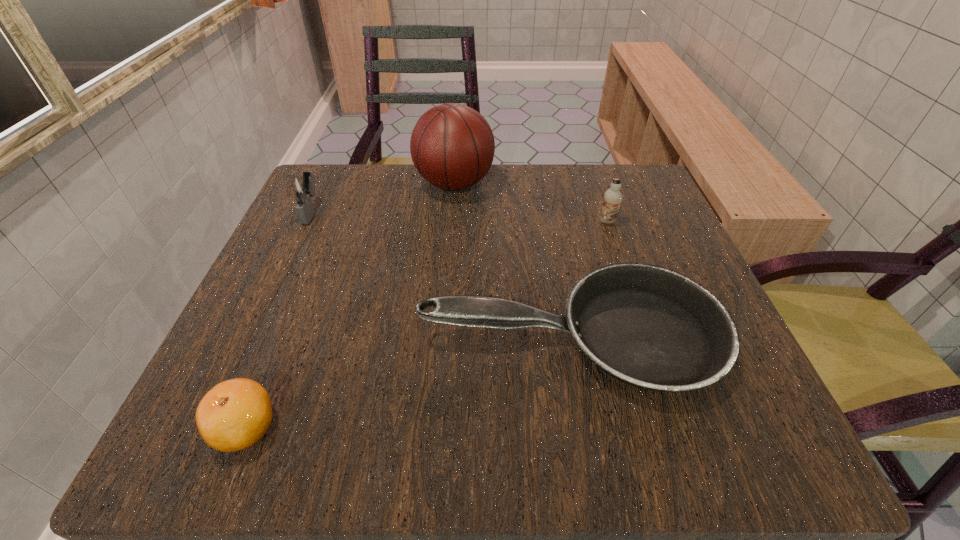
Where is `object that is at the near left corner`? object that is at the near left corner is located at coordinates (235, 414).

The height and width of the screenshot is (540, 960). I want to click on object positioned at the far right corner, so click(x=612, y=198).

Where is `object that is at the near right corner`? object that is at the near right corner is located at coordinates (647, 326).

This screenshot has height=540, width=960. Identify the location of vacant space at the far edge. (548, 215).

What are the coordinates of `vacant space at the near edge of the desktop` in the screenshot? It's located at (345, 437).

Identify the location of free space at the left edge. (278, 395).

Locate an element on the screen. Image resolution: width=960 pixels, height=540 pixels. free space at the right edge of the desktop is located at coordinates (687, 270).

This screenshot has height=540, width=960. I want to click on vacant space at the far right corner of the desktop, so click(x=599, y=167).

Identify the location of vacant space at the near right corner of the desktop. (662, 424).

Locate an element on the screen. The height and width of the screenshot is (540, 960). empty location between the igniter and the frying pan is located at coordinates (442, 274).